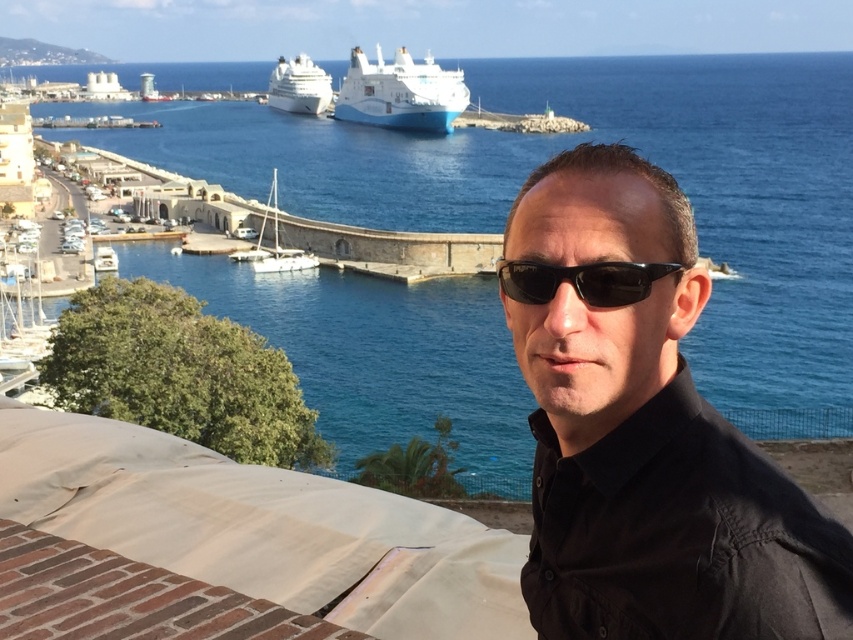
You are a photographer planning to take a wide shot of the coastal harbor scene. You want to ensure both the blue water at center and the white glossy cruise ship at center are fully visible in your frame. Based on their sizes, which object should you prioritize positioning closer to the center of your camera viewfinder to accommodate their relative sizes?

The blue water at center has a larger width than the white glossy cruise ship at center. Therefore, you should prioritize positioning the blue water at center closer to the center of your camera viewfinder since it requires more space to be fully captured in the frame.

You are standing at the position of the man in the image and want to take a photo of both point [135,113] and point [270,100]. Which point should you focus on first to ensure both are in focus?

You should focus on point [135,113] first because it is closer to the camera than point [270,100]. This ensures the depth of field will include both points when focusing on the nearer one.

You are a tour guide explaining the harbor layout to visitors. You mention the blue water at center and the white glossy cruise ship at center. How far apart are these two landmarks?

The distance between the blue water at center and the white glossy cruise ship at center is 207.02 feet.